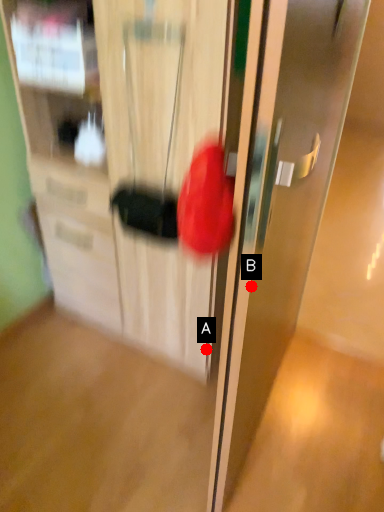
Question: Two points are circled on the image, labeled by A and B beside each circle. Which point appears closest to the camera in this image?

Choices:
 (A) A is closer
 (B) B is closer

Answer: (B)